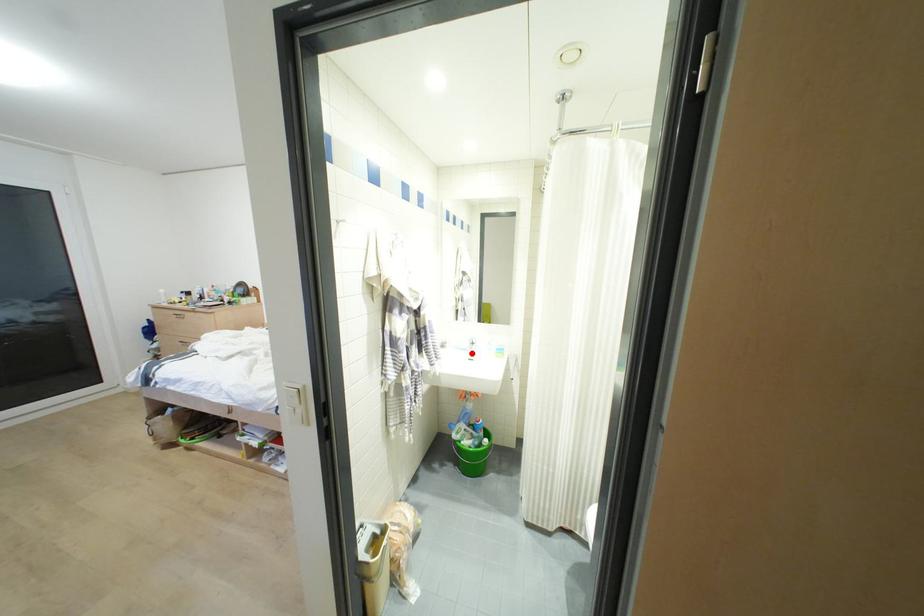
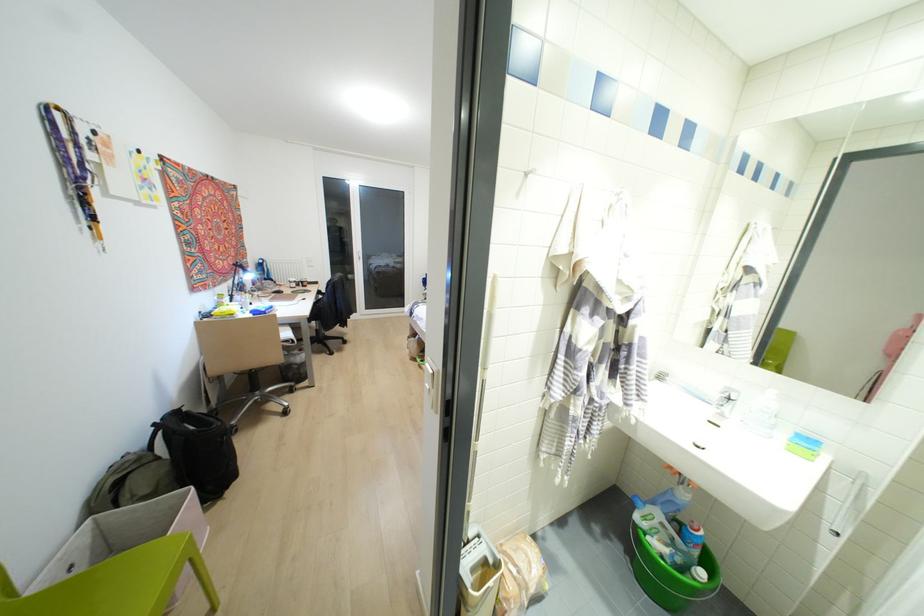
Question: I am providing you with two images of the same scene from different viewpoints. Image1 has a red point marked. In image2, the corresponding 3D location appears at what relative position? Reply with the corresponding letter.

Choices:
 (A) Closer
 (B) Farther

Answer: (A)